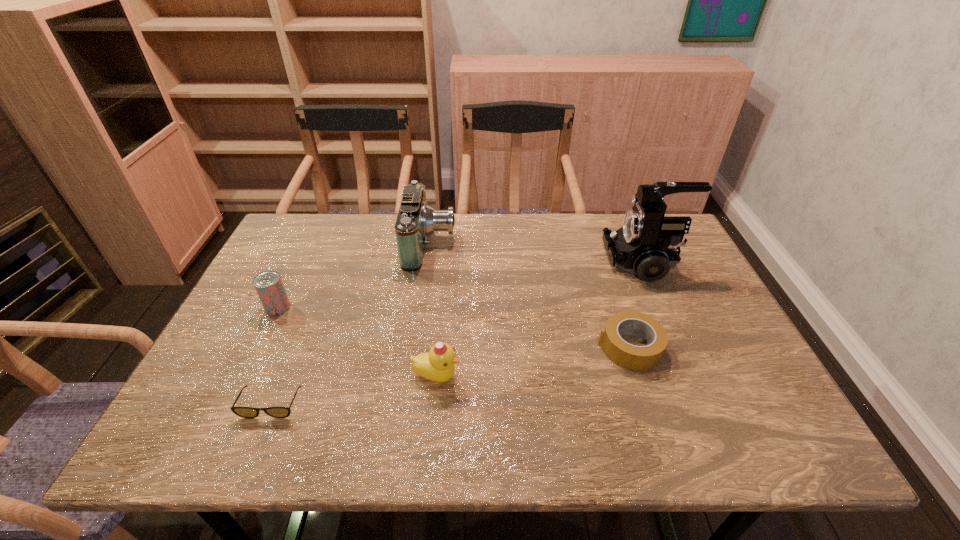
Find the location of a particular element. object that is the third closest to the duct tape is located at coordinates (416, 220).

You are a GUI agent. You are given a task and a screenshot of the screen. Output one action in this format:
    pyautogui.click(x=<x>, y=<y>)
    Task: Click on the free location that satisfies the following two spatial constraints: 1. on the front-facing side of the duckling; 2. on the front-facing side of the sunglasses
    
    Given the screenshot: What is the action you would take?
    pyautogui.click(x=434, y=404)

Locate an element on the screen. This screenshot has width=960, height=540. vacant point that satisfies the following two spatial constraints: 1. on the front-facing side of the left camcorder; 2. on the front-facing side of the shortest object is located at coordinates (407, 404).